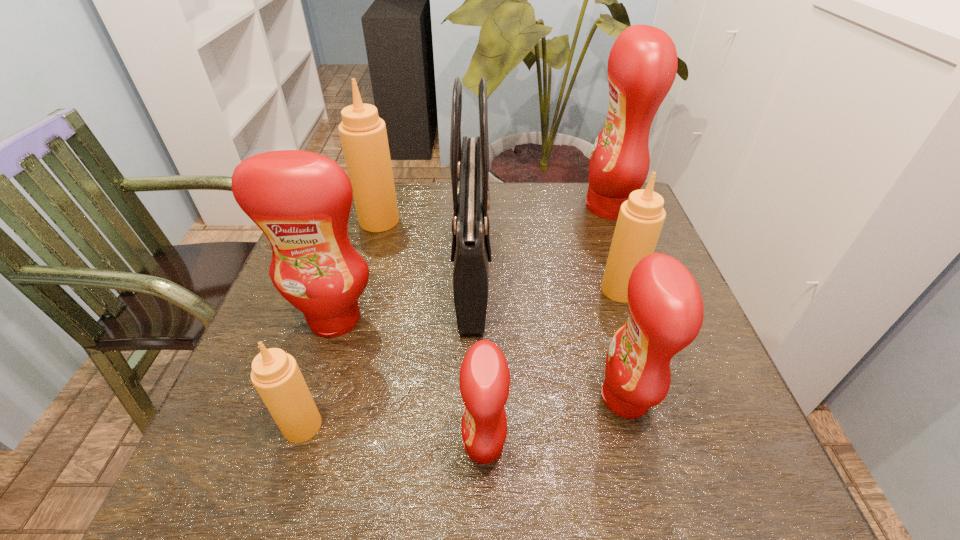
You are a GUI agent. You are given a task and a screenshot of the screen. Output one action in this format:
    pyautogui.click(x=<x>, y=<y>)
    Task: Click on the third red condiment from right to left
    
    Given the screenshot: What is the action you would take?
    pyautogui.click(x=484, y=380)

At what (x,y) coordinates should I click in order to perform the action: click on the smallest red condiment. Please return your answer as a coordinate pair (x, y). This screenshot has width=960, height=540. Looking at the image, I should click on (484, 380).

The image size is (960, 540). In order to click on free region located on the label side of the tallest condiment in this screenshot , I will do `click(498, 207)`.

Where is `vacant space located 0.170m on the label side of the tallest condiment`? This screenshot has height=540, width=960. vacant space located 0.170m on the label side of the tallest condiment is located at coordinates (523, 207).

This screenshot has height=540, width=960. I want to click on free space located 0.170m on the label side of the tallest condiment, so [x=523, y=207].

Identify the location of free region located with an open clasp on the front of the black handbag. (644, 268).

You are a GUI agent. You are given a task and a screenshot of the screen. Output one action in this format:
    pyautogui.click(x=<x>, y=<y>)
    Task: Click on the vacant space located 0.100m on the right of the farthest tan condiment
    The height and width of the screenshot is (540, 960).
    Given the screenshot: What is the action you would take?
    pyautogui.click(x=436, y=220)

Image resolution: width=960 pixels, height=540 pixels. What are the coordinates of `vacant space located 0.230m on the label side of the second farthest red condiment` in the screenshot? It's located at (293, 450).

I want to click on vacant space located 0.260m on the front of the second biggest tan condiment, so click(x=660, y=409).

Where is `free space located 0.240m on the label side of the second smallest red condiment`? This screenshot has width=960, height=540. free space located 0.240m on the label side of the second smallest red condiment is located at coordinates 467,398.